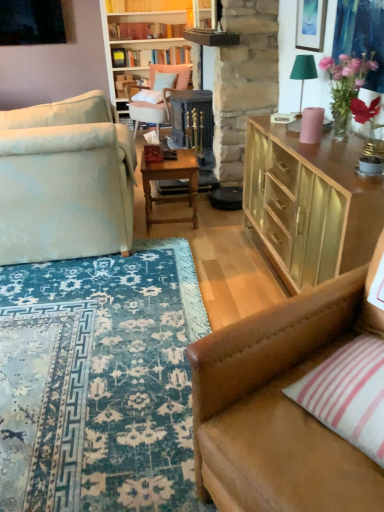
Question: From the image's perspective, does brown leather couch at lower right, arranged as the 1th studio couch when viewed from the right, appear lower than matte gold cabinet at upper right?

Choices:
 (A) no
 (B) yes

Answer: (B)

Question: Does brown leather couch at lower right, which is the 1th studio couch in bottom-to-top order, appear on the left side of matte gold cabinet at upper right?

Choices:
 (A) no
 (B) yes

Answer: (B)

Question: Is brown leather couch at lower right, arranged as the 1th studio couch when viewed from the right, facing towards matte gold cabinet at upper right?

Choices:
 (A) yes
 (B) no

Answer: (B)

Question: From a real-world perspective, does brown leather couch at lower right, the second studio couch viewed from the left, stand above matte gold cabinet at upper right?

Choices:
 (A) no
 (B) yes

Answer: (B)

Question: Does brown leather couch at lower right, marked as the second studio couch in a back-to-front arrangement, have a greater height compared to matte gold cabinet at upper right?

Choices:
 (A) no
 (B) yes

Answer: (B)

Question: Is point (279, 348) closer or farther from the camera than point (168, 174)?

Choices:
 (A) farther
 (B) closer

Answer: (B)

Question: From the image's perspective, is brown leather couch at lower right, the second studio couch viewed from the top, positioned above or below wooden table at center?

Choices:
 (A) above
 (B) below

Answer: (B)

Question: Do you think brown leather couch at lower right, marked as the second studio couch in a back-to-front arrangement, is within wooden table at center, or outside of it?

Choices:
 (A) outside
 (B) inside

Answer: (A)

Question: Considering the positions of brown leather couch at lower right, which is the 1th studio couch in bottom-to-top order, and wooden table at center in the image, is brown leather couch at lower right, which is the 1th studio couch in bottom-to-top order, wider or thinner than wooden table at center?

Choices:
 (A) wide
 (B) thin

Answer: (A)

Question: Which is correct: green fabric lampshade at upper right is inside pink fabric chair at upper center, or outside of it?

Choices:
 (A) inside
 (B) outside

Answer: (B)

Question: Looking at the image, does green fabric lampshade at upper right seem bigger or smaller compared to pink fabric chair at upper center?

Choices:
 (A) big
 (B) small

Answer: (B)

Question: Is green fabric lampshade at upper right taller or shorter than pink fabric chair at upper center?

Choices:
 (A) short
 (B) tall

Answer: (A)

Question: Is point (296, 62) positioned closer to the camera than point (183, 81)?

Choices:
 (A) farther
 (B) closer

Answer: (B)

Question: Considering the positions of point [x=167, y=50] and point [x=322, y=29], is point [x=167, y=50] closer or farther from the camera than point [x=322, y=29]?

Choices:
 (A) closer
 (B) farther

Answer: (B)

Question: From a real-world perspective, relative to matte gold picture frame at upper right, is hardcover books at upper center, which ranks as the first book in back-to-front order, vertically above or below?

Choices:
 (A) above
 (B) below

Answer: (B)